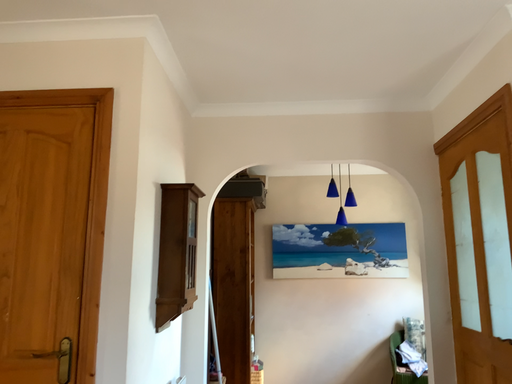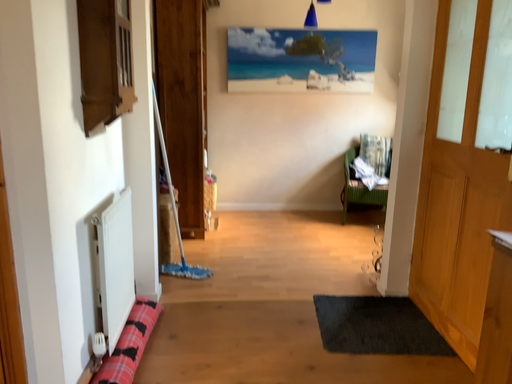
Question: Which way did the camera rotate in the video?

Choices:
 (A) rotated upward
 (B) rotated downward

Answer: (B)